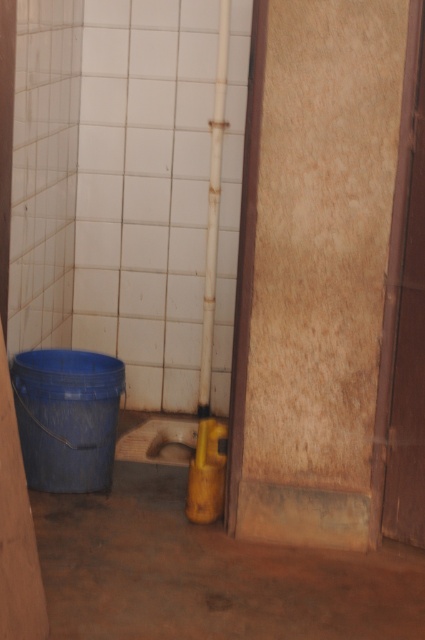
Question: Which object appears closest to the camera in this image?

Choices:
 (A) blue plastic bucket at lower left
 (B) yellow matte barrel at lower center

Answer: (B)

Question: Which point is closer to the camera taking this photo?

Choices:
 (A) (209, 461)
 (B) (22, 384)

Answer: (A)

Question: In this image, where is blue plastic bucket at lower left located relative to yellow matte barrel at lower center?

Choices:
 (A) left
 (B) right

Answer: (A)

Question: Can you confirm if blue plastic bucket at lower left is wider than yellow matte barrel at lower center?

Choices:
 (A) yes
 (B) no

Answer: (A)

Question: Which point is closer to the camera?

Choices:
 (A) yellow matte barrel at lower center
 (B) blue plastic bucket at lower left

Answer: (A)

Question: Considering the relative positions of blue plastic bucket at lower left and yellow matte barrel at lower center in the image provided, where is blue plastic bucket at lower left located with respect to yellow matte barrel at lower center?

Choices:
 (A) below
 (B) above

Answer: (B)